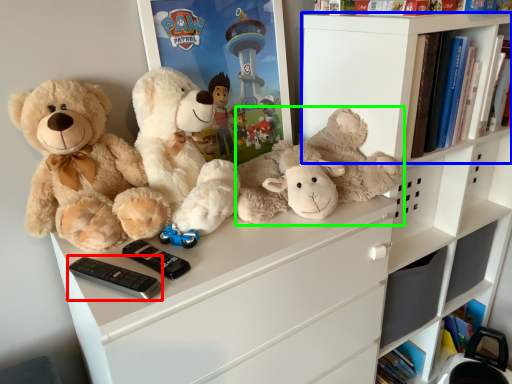
Question: Which object is positioned farthest from control (highlighted by a red box)? Select from shelf (highlighted by a blue box) and teddy bear (highlighted by a green box).

Choices:
 (A) shelf
 (B) teddy bear

Answer: (A)